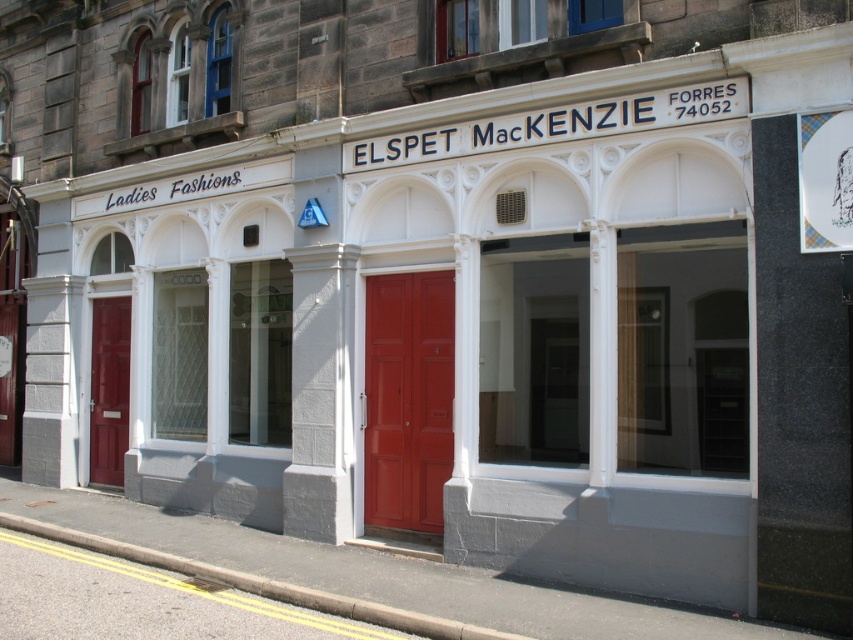
Question: Does matte red door at center have a smaller size compared to matte red door at left?

Choices:
 (A) yes
 (B) no

Answer: (B)

Question: Which point is closer to the camera?

Choices:
 (A) (450, 337)
 (B) (109, 406)

Answer: (A)

Question: Which of the following is the farthest from the observer?

Choices:
 (A) matte red door at center
 (B) matte red door at left

Answer: (B)

Question: Does matte red door at center appear over matte red door at left?

Choices:
 (A) no
 (B) yes

Answer: (B)

Question: Is matte red door at center to the right of matte red door at left from the viewer's perspective?

Choices:
 (A) yes
 (B) no

Answer: (A)